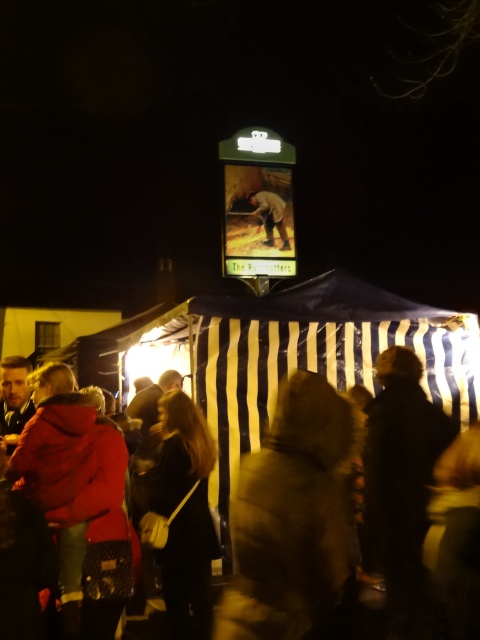
Locate an element on the screen. The image size is (480, 640). dark brown leather jacket at lower center is located at coordinates (402, 470).

Who is positioned more to the left, dark brown leather jacket at lower center or brown leather jacket at center?

brown leather jacket at center is more to the left.

Image resolution: width=480 pixels, height=640 pixels. In order to click on dark brown leather jacket at lower center in this screenshot , I will do `click(402, 470)`.

You are a GUI agent. You are given a task and a screenshot of the screen. Output one action in this format:
    pyautogui.click(x=<x>, y=<y>)
    Task: Click on the dark brown leather jacket at lower center
    The height and width of the screenshot is (640, 480).
    Given the screenshot: What is the action you would take?
    pyautogui.click(x=402, y=470)

Consider the image. Who is higher up, dark brown leather jacket at lower center or dark brown leather jacket at center?

dark brown leather jacket at lower center

Is point (372, 522) positioned after point (192, 532)?

Yes, point (372, 522) is farther from viewer.

You are a GUI agent. You are given a task and a screenshot of the screen. Output one action in this format:
    pyautogui.click(x=<x>, y=<y>)
    Task: Click on the dark brown leather jacket at lower center
    
    Given the screenshot: What is the action you would take?
    pyautogui.click(x=402, y=470)

Can you confirm if dark brown leather jacket at center is wider than brown leather jacket at center?

In fact, dark brown leather jacket at center might be narrower than brown leather jacket at center.

Consider the image. Is dark brown leather jacket at center behind brown leather jacket at center?

That is False.

I want to click on dark brown leather jacket at center, so click(181, 513).

Find the location of a particular element. The image size is (480, 640). dark brown leather jacket at center is located at coordinates 181,513.